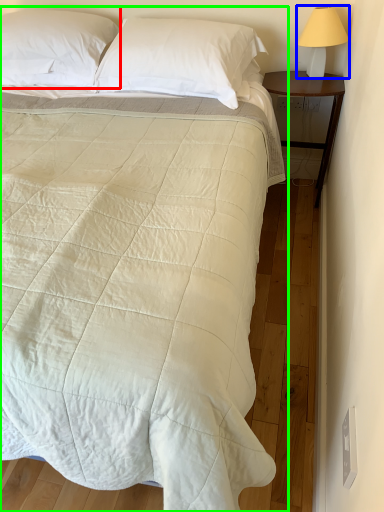
Question: Which is nearer to the pillow (highlighted by a red box)? bedside lamp (highlighted by a blue box) or bed (highlighted by a green box).

Choices:
 (A) bedside lamp
 (B) bed

Answer: (B)